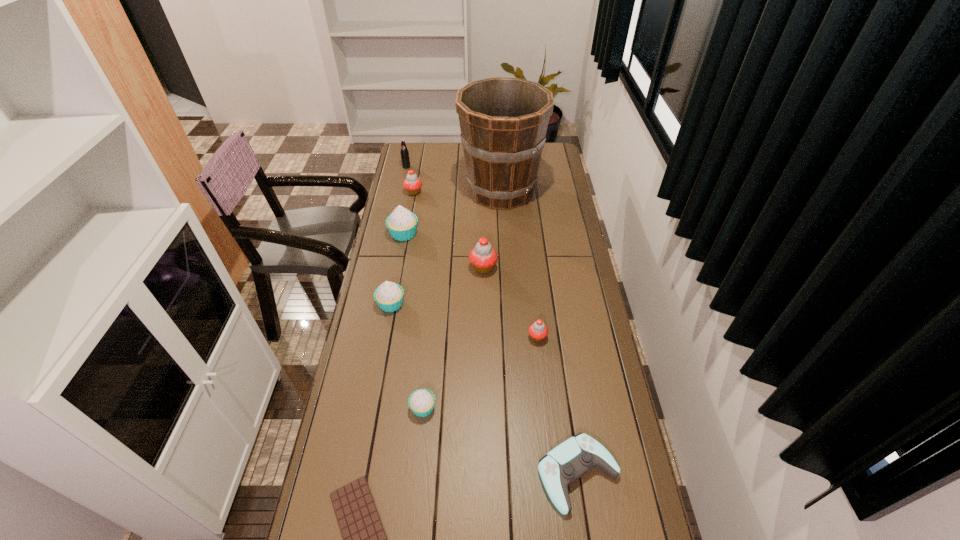
You are a GUI agent. You are given a task and a screenshot of the screen. Output one action in this format:
    pyautogui.click(x=<x>, y=<y>)
    Task: Click on the eighth farthest object
    The height and width of the screenshot is (540, 960).
    Given the screenshot: What is the action you would take?
    pyautogui.click(x=421, y=402)

This screenshot has height=540, width=960. Find the location of `the nearest white cupcake`. the nearest white cupcake is located at coordinates (421, 402).

This screenshot has height=540, width=960. Find the location of `the smallest red cupcake`. the smallest red cupcake is located at coordinates click(x=538, y=331).

You are a GUI agent. You are given a task and a screenshot of the screen. Output one action in this format:
    pyautogui.click(x=<x>, y=<y>)
    Task: Click on the rightmost red cupcake
    The image size is (960, 540).
    Given the screenshot: What is the action you would take?
    pyautogui.click(x=538, y=331)

Where is `control`? This screenshot has height=540, width=960. control is located at coordinates (573, 458).

Identify the location of vacant space located on the back of the tallest object. (498, 145).

I want to click on vacant space situated 0.110m on the front label of the black pop, so click(403, 181).

At what (x,y) coordinates should I click in order to perform the action: click on vacant region located on the right of the second nearest red cupcake. Please return your answer as a coordinate pair (x, y). The image size is (960, 540). Looking at the image, I should click on (532, 267).

The height and width of the screenshot is (540, 960). I want to click on free space located 0.380m on the front of the second farthest cupcake, so click(x=389, y=313).

Locate an element on the screen. Image resolution: width=960 pixels, height=540 pixels. vacant space located 0.290m on the front of the second smallest white cupcake is located at coordinates (376, 386).